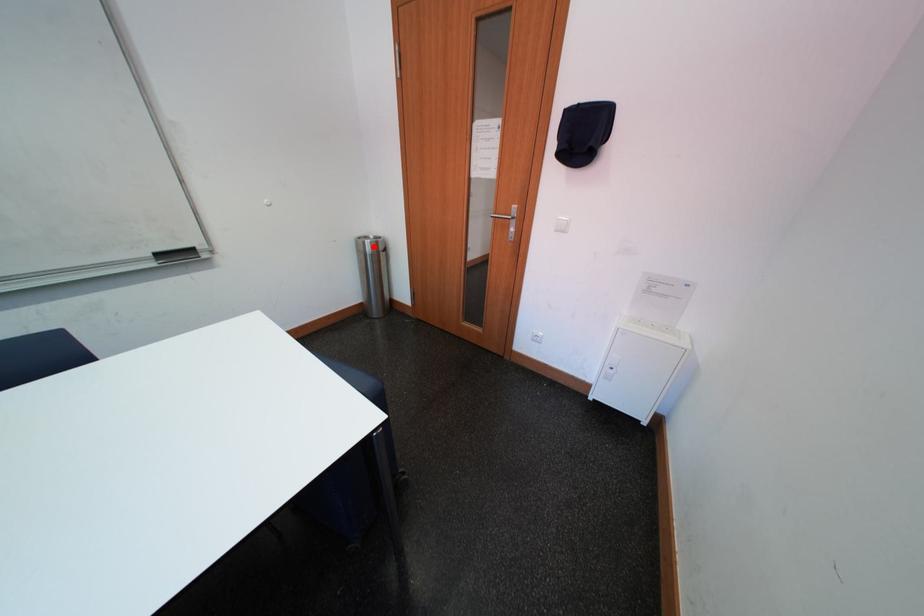
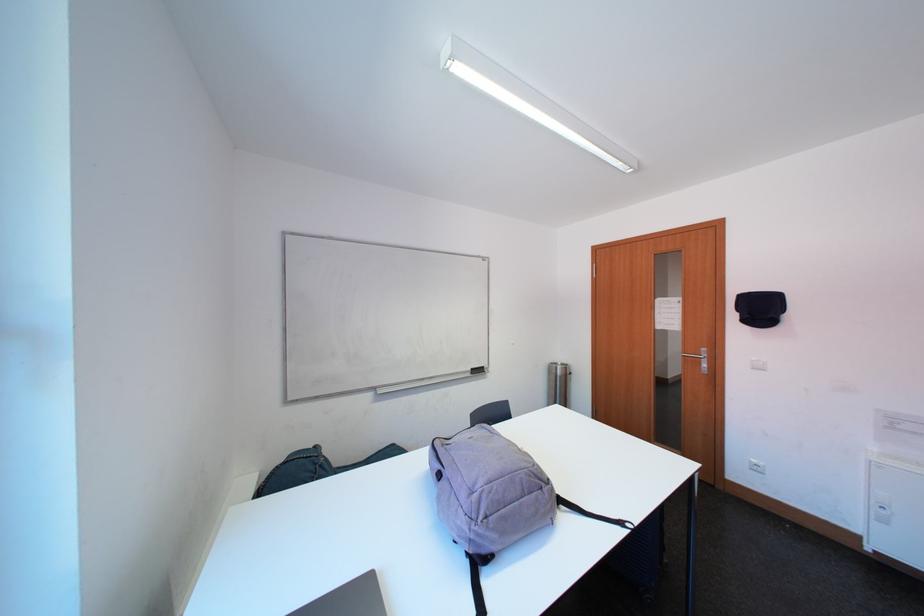
Question: I am providing you with two images of the same scene from different viewpoints. Image1 has a red point marked. In image2, the corresponding 3D location appears at what relative position? Reply with the corresponding letter.

Choices:
 (A) Closer
 (B) Farther

Answer: (B)